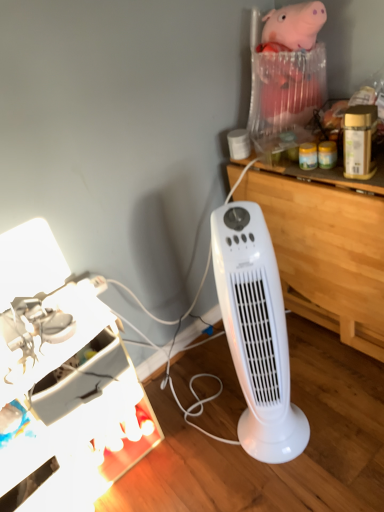
The width and height of the screenshot is (384, 512). In order to click on free space behind white plastic tower fan at center in this screenshot , I will do `click(238, 388)`.